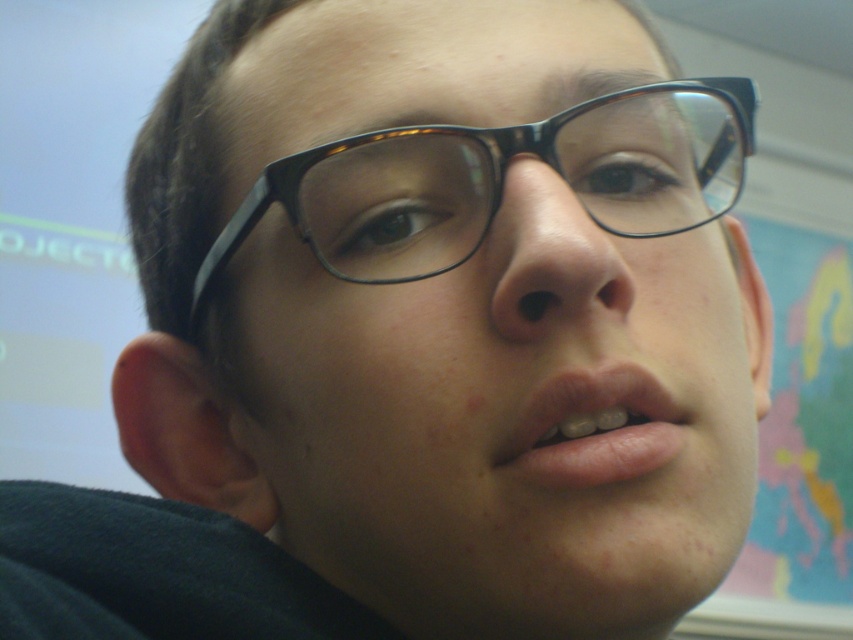
Between matte black glasses at center and black acetate glasses at center, which one appears on the right side from the viewer's perspective?

Positioned to the right is matte black glasses at center.

Image resolution: width=853 pixels, height=640 pixels. What do you see at coordinates (503, 419) in the screenshot? I see `matte black glasses at center` at bounding box center [503, 419].

The image size is (853, 640). In order to click on matte black glasses at center in this screenshot , I will do `click(503, 419)`.

Can you confirm if matte skin nose at center is wider than pink matte lips at center?

Answer: In fact, matte skin nose at center might be narrower than pink matte lips at center.

Who is more distant from viewer, (543, 243) or (605, 403)?

Positioned behind is point (605, 403).

Find the location of a particular element. matte skin nose at center is located at coordinates click(548, 259).

This screenshot has height=640, width=853. Identify the location of black acetate glasses at center. (502, 179).

Is point (352, 227) closer to camera compared to point (572, 202)?

No, it is behind (572, 202).

Between point (469, 216) and point (585, 284), which one is positioned behind?

The point (469, 216) is behind.

Locate an element on the screen. This screenshot has width=853, height=640. black acetate glasses at center is located at coordinates (502, 179).